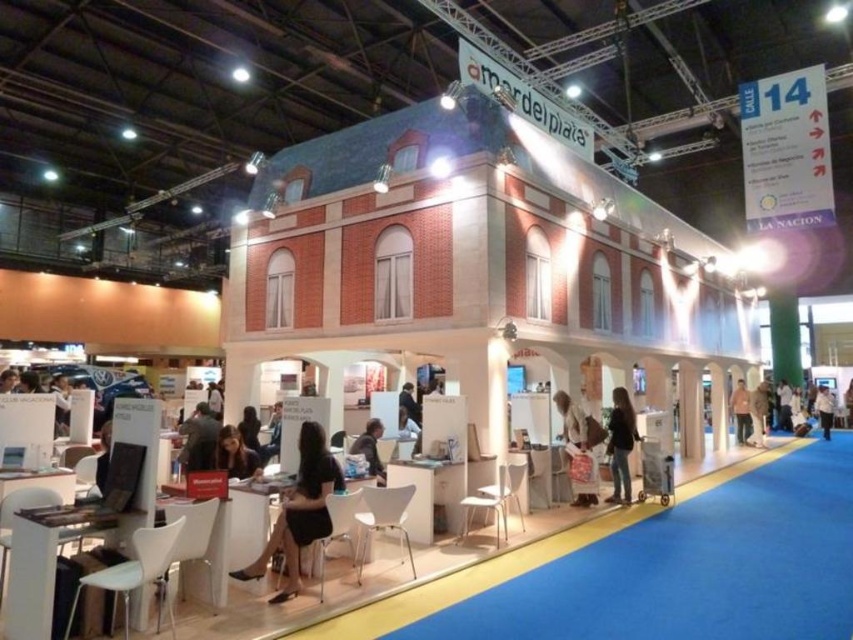
Question: Estimate the real-world distances between objects in this image. Which object is closer to the black leather jacket at lower right?

Choices:
 (A) dark gray fabric jacket at center
 (B) black fabric dress at center
 (C) white fabric shirt at center
 (D) dark brown leather jacket at center

Answer: (D)

Question: Is matte black shirt at center to the right of dark brown leather jacket at center from the viewer's perspective?

Choices:
 (A) yes
 (B) no

Answer: (A)

Question: Which point is closer to the camera taking this photo?

Choices:
 (A) coord(199,404)
 (B) coord(248,424)
 (C) coord(781,401)

Answer: (B)

Question: Estimate the real-world distances between objects in this image. Which object is closer to the brown leather jacket at center?

Choices:
 (A) light brown leather jacket at center
 (B) dark gray fabric jacket at center
 (C) dark brown hair at center
 (D) matte black shirt at center

Answer: (A)

Question: Is matte black shirt at center bigger than dark brown leather jacket at center?

Choices:
 (A) yes
 (B) no

Answer: (A)

Question: Is matte black shirt at center further to the viewer compared to dark brown leather jacket at center?

Choices:
 (A) yes
 (B) no

Answer: (B)